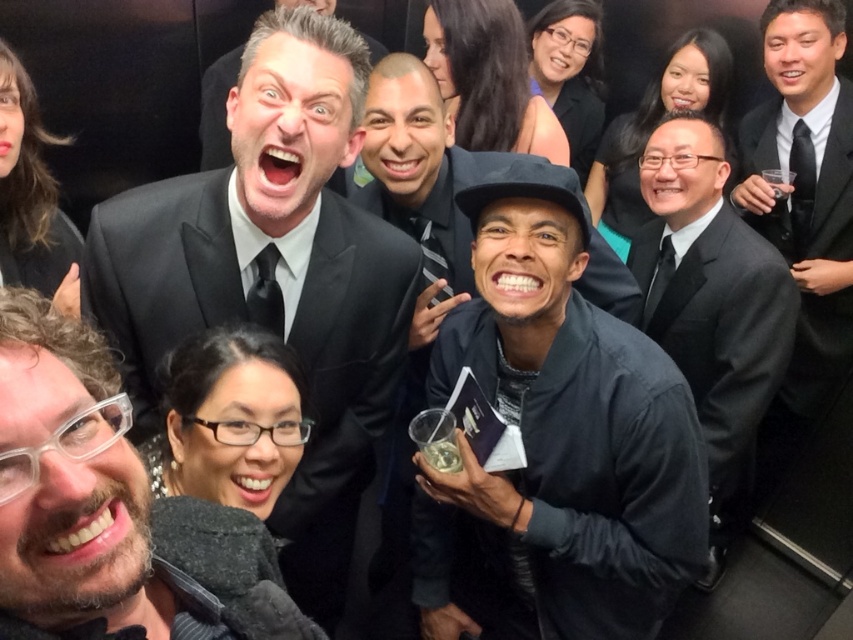
Which of these two, matte black suit at upper center or black satin suit at upper center, stands shorter?

With less height is black satin suit at upper center.

Which is behind, point (318, 358) or point (215, 166)?

The point (215, 166) is behind.

Image resolution: width=853 pixels, height=640 pixels. What do you see at coordinates (273, 276) in the screenshot?
I see `matte black suit at upper center` at bounding box center [273, 276].

The height and width of the screenshot is (640, 853). Find the location of `matte black suit at upper center`. matte black suit at upper center is located at coordinates (x=273, y=276).

Can you confirm if smooth black hair at upper center is positioned above black matte jacket at upper center?

Actually, smooth black hair at upper center is below black matte jacket at upper center.

Does point (515, 86) come closer to viewer compared to point (544, 22)?

Yes, it is.

You are a GUI agent. You are given a task and a screenshot of the screen. Output one action in this format:
    pyautogui.click(x=<x>, y=<y>)
    Task: Click on the smooth black hair at upper center
    
    Given the screenshot: What is the action you would take?
    pyautogui.click(x=488, y=77)

Is dark brown hair at left to the left of black matte jacket at upper center from the viewer's perspective?

Correct, you'll find dark brown hair at left to the left of black matte jacket at upper center.

Does dark brown hair at left have a lesser height compared to black matte jacket at upper center?

Yes.

Does point (30, 129) come closer to viewer compared to point (585, 68)?

That is True.

At what (x,y) coordinates should I click in order to perform the action: click on dark brown hair at left. Please return your answer as a coordinate pair (x, y). This screenshot has height=640, width=853. Looking at the image, I should click on (32, 196).